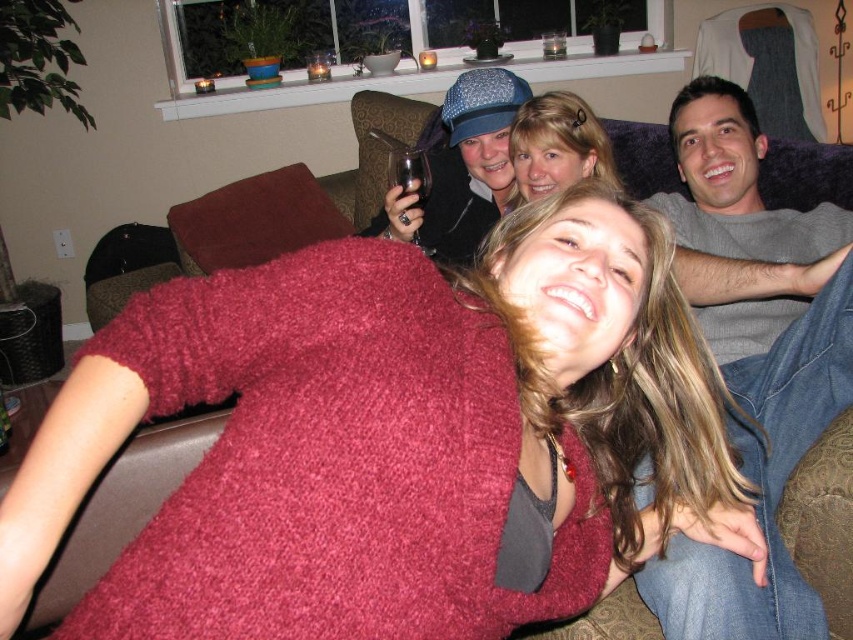
Who is more forward, (712, 99) or (585, 166)?

Point (712, 99) is more forward.

I want to click on gray soft shirt at upper right, so click(x=752, y=356).

Is gray soft shirt at upper right below gray soft blanket at upper right?

Yes, gray soft shirt at upper right is below gray soft blanket at upper right.

Who is positioned more to the left, gray soft shirt at upper right or gray soft blanket at upper right?

Positioned to the left is gray soft shirt at upper right.

Find the location of `gray soft shirt at upper right`. gray soft shirt at upper right is located at coordinates (752, 356).

Is gray soft blanket at upper right shorter than blonde hair at center?

No, gray soft blanket at upper right is not shorter than blonde hair at center.

Is gray soft blanket at upper right taller than blonde hair at center?

Indeed, gray soft blanket at upper right has a greater height compared to blonde hair at center.

Locate an element on the screen. gray soft blanket at upper right is located at coordinates (740, 225).